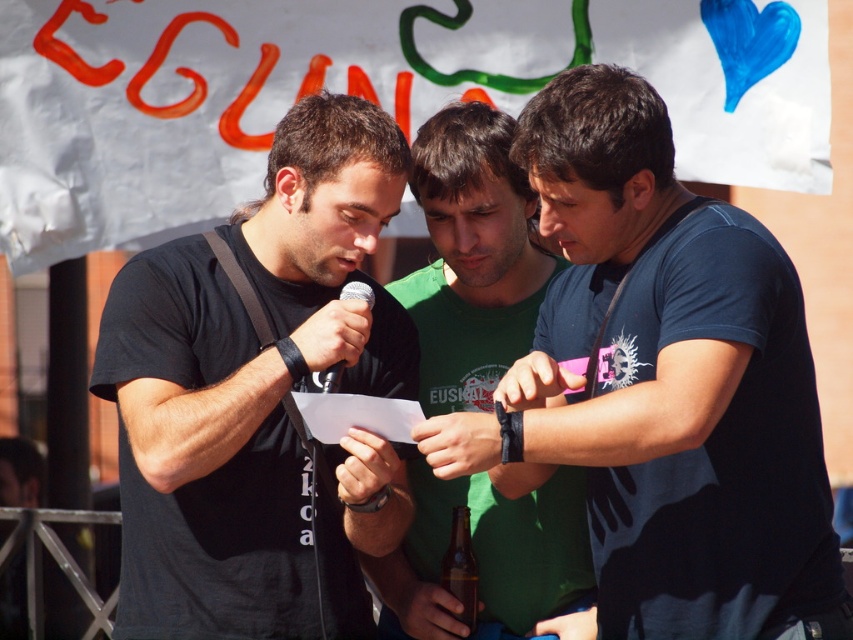
Question: Is green cotton shirt at center to the left of brown glass bottle at center from the viewer's perspective?

Choices:
 (A) no
 (B) yes

Answer: (A)

Question: Can you confirm if blue cotton shirt at center is positioned below black matte t-shirt at center?

Choices:
 (A) no
 (B) yes

Answer: (A)

Question: Which of these objects is positioned farthest from the green cotton shirt at center?

Choices:
 (A) blue cotton shirt at center
 (B) brown glass bottle at center

Answer: (A)

Question: Which point is closer to the camera taking this photo?

Choices:
 (A) (138, 584)
 (B) (450, 336)
 (C) (717, 620)
 (D) (453, 525)

Answer: (C)

Question: Which of the following is the closest to the observer?

Choices:
 (A) brown glass bottle at center
 (B) black matte t-shirt at center
 (C) green cotton shirt at center

Answer: (B)

Question: Is green cotton shirt at center bigger than brown glass bottle at center?

Choices:
 (A) no
 (B) yes

Answer: (B)